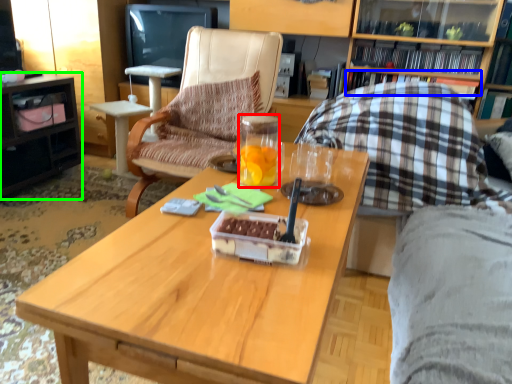
Question: Estimate the real-world distances between objects in this image. Which object is closer to coffee cup (highlighted by a red box), book (highlighted by a blue box) or desk (highlighted by a green box)?

Choices:
 (A) book
 (B) desk

Answer: (A)